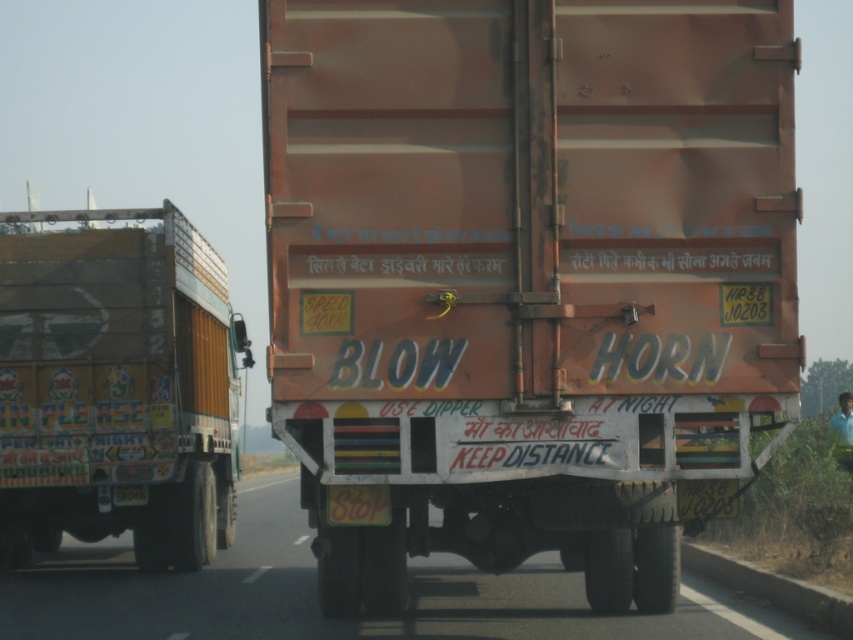
Question: Is orange matte trailer truck at center below painted wooden truck at left?

Choices:
 (A) yes
 (B) no

Answer: (A)

Question: Which object is the closest to the painted wooden truck at left?

Choices:
 (A) orange matte truck at center
 (B) orange matte trailer truck at center

Answer: (A)

Question: Is orange matte trailer truck at center positioned at the back of orange matte truck at center?

Choices:
 (A) yes
 (B) no

Answer: (B)

Question: Which of the following is the closest to the observer?

Choices:
 (A) orange matte truck at center
 (B) painted wooden truck at left
 (C) orange matte trailer truck at center

Answer: (C)

Question: Which point is farther from the camera taking this photo?

Choices:
 (A) (277, 100)
 (B) (546, 568)
 (C) (173, 352)

Answer: (B)

Question: From the image, what is the correct spatial relationship of painted wooden truck at left in relation to orange matte truck at center?

Choices:
 (A) below
 (B) above

Answer: (B)